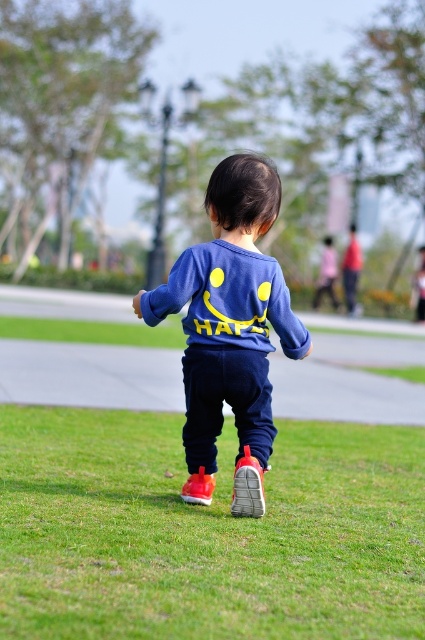
You are standing at the point marked by the coordinate [206,532] in the image. Looking around, you see a child wearing a navy blue shirt with a yellow smiley face and the word HAPPY on the back, along with dark blue pants and red sneakers. Based on your position, which direction should you walk to reach the child?

Since the green grass at lower center is represented by the point [206,532], and the child is walking away from the camera on the grassy area, you should walk forward towards the direction the child is facing to reach them.

You are a photographer trying to capture the blue matte sweatshirt at center and the green grass at lower center in the same frame. Based on their positions, which object should appear larger in the photo?

The green grass at lower center is closer to the viewer than the blue matte sweatshirt at center, so it should appear larger in the photo.